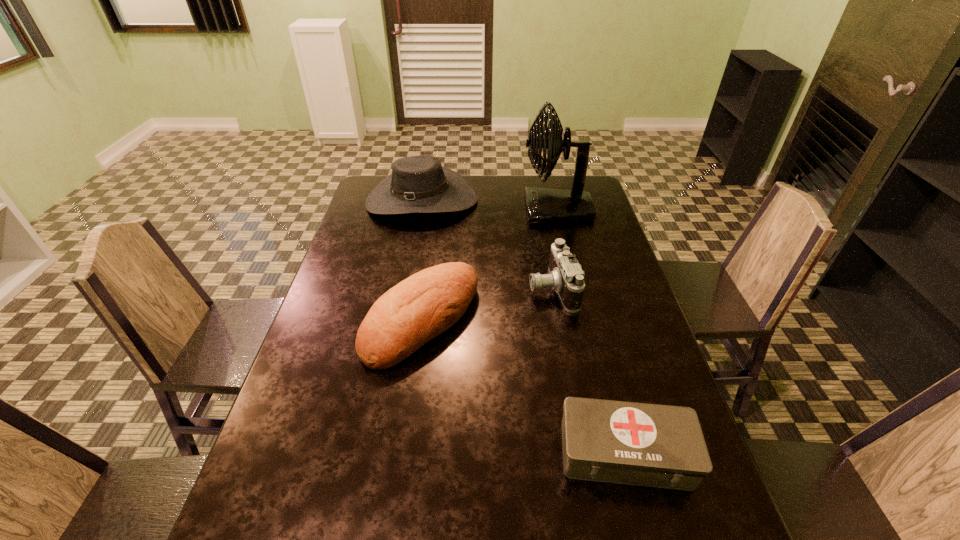
The width and height of the screenshot is (960, 540). Find the location of `the tallest object`. the tallest object is located at coordinates (544, 206).

At what (x,y) coordinates should I click in order to perform the action: click on cowboy hat. Please return your answer as a coordinate pair (x, y). The image size is (960, 540). Looking at the image, I should click on (418, 184).

You are a GUI agent. You are given a task and a screenshot of the screen. Output one action in this format:
    pyautogui.click(x=<x>, y=<y>)
    Task: Click on the camera
    The image size is (960, 540).
    Given the screenshot: What is the action you would take?
    pyautogui.click(x=566, y=277)

In order to click on bread in this screenshot , I will do `click(429, 302)`.

Identify the location of the nearest object. The height and width of the screenshot is (540, 960). (663, 446).

At what (x,y) coordinates should I click in order to perform the action: click on the first-aid kit. Please return your answer as a coordinate pair (x, y). Looking at the image, I should click on (663, 446).

I want to click on free space located in front of the tallest object to blow air, so click(x=497, y=210).

Where is `blank space located in front of the tallest object to blow air`? blank space located in front of the tallest object to blow air is located at coordinates 505,210.

In order to click on vacant position located in front of the tallest object to blow air in this screenshot , I will do `click(445, 210)`.

Where is `vacant space located 0.130m on the front-facing side of the fourth shortest object`? The height and width of the screenshot is (540, 960). vacant space located 0.130m on the front-facing side of the fourth shortest object is located at coordinates (413, 249).